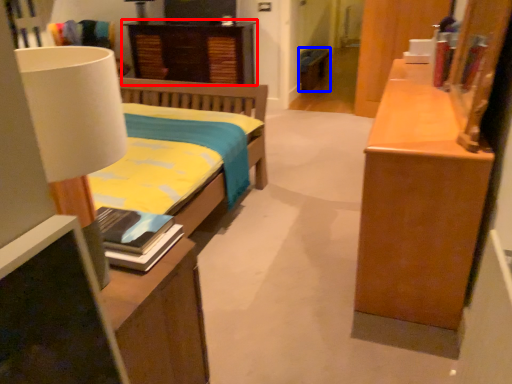
Question: Which object is closer to the camera taking this photo, nightstand (highlighted by a red box) or cabinetry (highlighted by a blue box)?

Choices:
 (A) nightstand
 (B) cabinetry

Answer: (A)